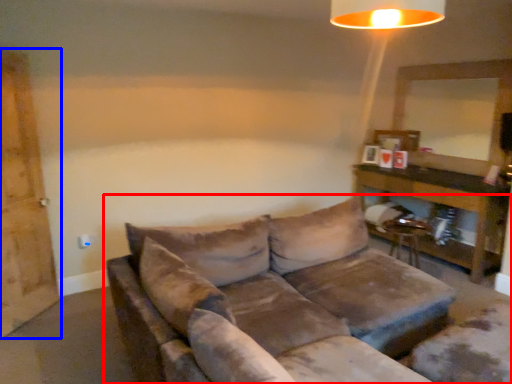
Question: Among these objects, which one is nearest to the camera, studio couch (highlighted by a red box) or barn door (highlighted by a blue box)?

Choices:
 (A) studio couch
 (B) barn door

Answer: (A)